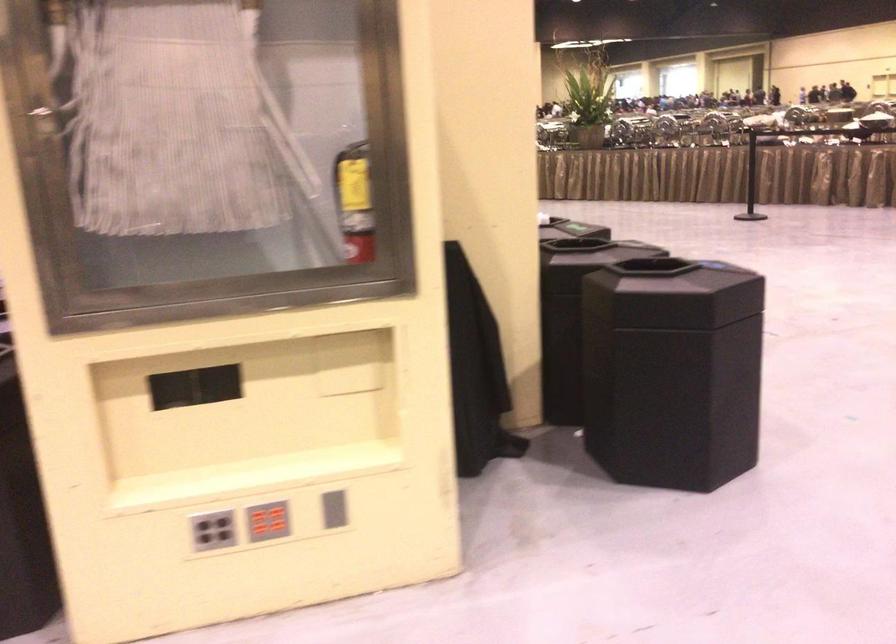
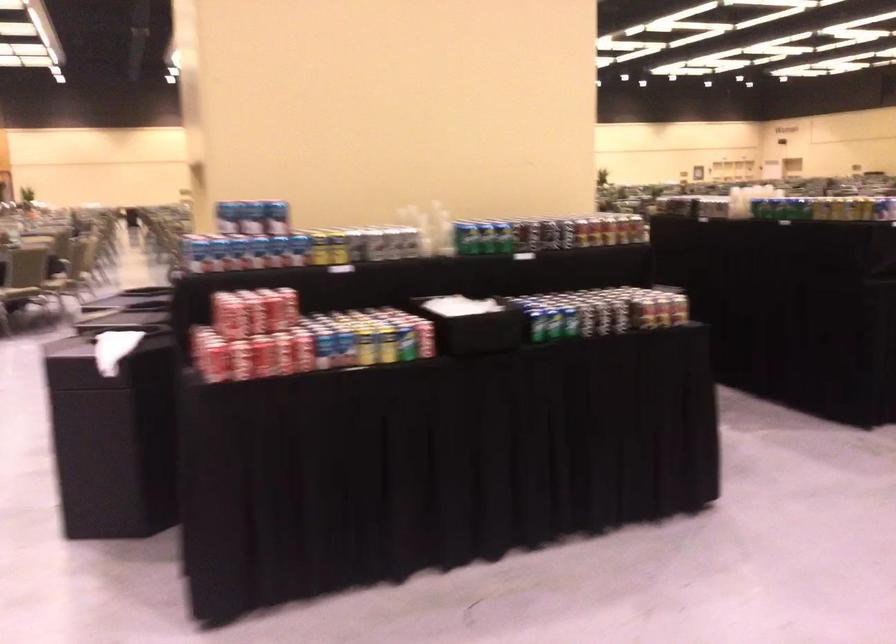
Question: I am providing you with two images of the same scene from different viewpoints. After the viewpoint changes to image2, which objects are now occluded?

Choices:
 (A) red button panel
 (B) clear plastic cup
 (C) red soda can
 (D) stuffed teddy bear

Answer: (A)